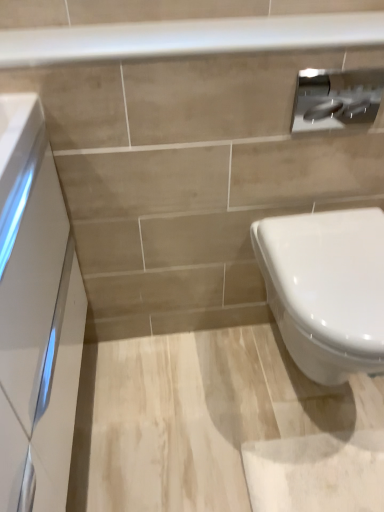
Where is `white glossy cabinet at left`? The width and height of the screenshot is (384, 512). white glossy cabinet at left is located at coordinates point(35,316).

Measure the distance between point (342, 76) and camera.

Point (342, 76) is 38.46 inches away from camera.

What do you see at coordinates (336, 98) in the screenshot? I see `satin silver toilet paper at upper right` at bounding box center [336, 98].

Identify the location of white glossy toilet at lower right. The width and height of the screenshot is (384, 512). (326, 289).

Find the location of a particular element. The height and width of the screenshot is (512, 384). white glossy balustrade at upper center is located at coordinates (189, 38).

Is the surface of white glossy toilet at lower right in direct contact with white glossy balustrade at upper center?

No, white glossy toilet at lower right is not making contact with white glossy balustrade at upper center.

From the image's perspective, is white glossy toilet at lower right below white glossy balustrade at upper center?

Yes.

Who is bigger, white glossy toilet at lower right or white glossy balustrade at upper center?

white glossy toilet at lower right is bigger.

Is white glossy toilet at lower right turned away from white glossy balustrade at upper center?

white glossy toilet at lower right does not have its back to white glossy balustrade at upper center.

How far apart are white glossy toilet at lower right and white glossy cabinet at left?

white glossy toilet at lower right is 23.64 inches away from white glossy cabinet at left.

Which object is positioned more to the left, white glossy toilet at lower right or white glossy cabinet at left?

white glossy cabinet at left is more to the left.

Is white glossy toilet at lower right outside of white glossy cabinet at left?

Yes, white glossy toilet at lower right is outside of white glossy cabinet at left.

Considering the sizes of objects white glossy toilet at lower right and white glossy cabinet at left in the image provided, who is taller, white glossy toilet at lower right or white glossy cabinet at left?

With more height is white glossy cabinet at left.

Where is `toilet paper above the white glossy cabinet at left (from a real-world perspective)`? The height and width of the screenshot is (512, 384). toilet paper above the white glossy cabinet at left (from a real-world perspective) is located at coordinates (336, 98).

From a real-world perspective, which is physically below, white glossy cabinet at left or satin silver toilet paper at upper right?

From a 3D spatial view, white glossy cabinet at left is below.

Which object is wider, white glossy cabinet at left or satin silver toilet paper at upper right?

white glossy cabinet at left is wider.

Consider the image. Which is correct: white glossy cabinet at left is inside satin silver toilet paper at upper right, or outside of it?

The correct answer is: outside.

From the image's perspective, between white glossy toilet at lower right and satin silver toilet paper at upper right, who is located below?

white glossy toilet at lower right appears lower in the image.

From a real-world perspective, is white glossy toilet at lower right positioned above or below satin silver toilet paper at upper right?

Clearly, from a real-world perspective, white glossy toilet at lower right is below satin silver toilet paper at upper right.

Considering the positions of objects white glossy toilet at lower right and satin silver toilet paper at upper right in the image provided, who is more to the right, white glossy toilet at lower right or satin silver toilet paper at upper right?

white glossy toilet at lower right.

Considering the sizes of white glossy toilet at lower right and satin silver toilet paper at upper right in the image, is white glossy toilet at lower right bigger or smaller than satin silver toilet paper at upper right?

Considering their sizes, white glossy toilet at lower right takes up more space than satin silver toilet paper at upper right.

From a real-world perspective, is white glossy balustrade at upper center below white glossy toilet at lower right?

No, from a real-world perspective, white glossy balustrade at upper center is not beneath white glossy toilet at lower right.

Is white glossy balustrade at upper center oriented towards white glossy toilet at lower right?

No, white glossy balustrade at upper center is not turned towards white glossy toilet at lower right.

Between white glossy balustrade at upper center and white glossy toilet at lower right, which one has larger width?

With larger width is white glossy toilet at lower right.

I want to click on balustrade that is behind the white glossy toilet at lower right, so (x=189, y=38).

Which is nearer, (132, 50) or (307, 116)?

Point (132, 50)

Is white glossy balustrade at upper center positioned far away from satin silver toilet paper at upper right?

No.

Between white glossy balustrade at upper center and satin silver toilet paper at upper right, which one has smaller size?

satin silver toilet paper at upper right is smaller.

From the image's perspective, which is below, white glossy balustrade at upper center or satin silver toilet paper at upper right?

satin silver toilet paper at upper right is shown below in the image.

Is satin silver toilet paper at upper right completely or partially outside of white glossy cabinet at left?

Indeed, satin silver toilet paper at upper right is completely outside white glossy cabinet at left.

From the image's perspective, which is above, satin silver toilet paper at upper right or white glossy cabinet at left?

From the image's view, satin silver toilet paper at upper right is above.

Does satin silver toilet paper at upper right have a lesser height compared to white glossy cabinet at left?

Correct, satin silver toilet paper at upper right is not as tall as white glossy cabinet at left.

Between satin silver toilet paper at upper right and white glossy cabinet at left, which one has larger size?

white glossy cabinet at left.

Identify the location of toilet below the white glossy balustrade at upper center (from the image's perspective). The width and height of the screenshot is (384, 512). (326, 289).

This screenshot has height=512, width=384. I want to click on toilet on the right of white glossy cabinet at left, so click(x=326, y=289).

When comparing their distances from white glossy cabinet at left, does white glossy balustrade at upper center or white glossy toilet at lower right seem closer?

Among the two, white glossy balustrade at upper center is located nearer to white glossy cabinet at left.

Estimate the real-world distances between objects in this image. Which object is further from satin silver toilet paper at upper right, white glossy balustrade at upper center or white glossy cabinet at left?

white glossy cabinet at left is positioned further to the anchor satin silver toilet paper at upper right.

Based on their spatial positions, is white glossy toilet at lower right or satin silver toilet paper at upper right further from white glossy balustrade at upper center?

The object further to white glossy balustrade at upper center is white glossy toilet at lower right.

Which object lies further to the anchor point white glossy cabinet at left, satin silver toilet paper at upper right or white glossy toilet at lower right?

satin silver toilet paper at upper right.

From the image, which object appears to be nearer to white glossy toilet at lower right, white glossy balustrade at upper center or satin silver toilet paper at upper right?

satin silver toilet paper at upper right lies closer to white glossy toilet at lower right than the other object.

Looking at the image, which one is located closer to white glossy toilet at lower right, satin silver toilet paper at upper right or white glossy balustrade at upper center?

The object closer to white glossy toilet at lower right is satin silver toilet paper at upper right.

Estimate the real-world distances between objects in this image. Which object is further from white glossy toilet at lower right, white glossy balustrade at upper center or white glossy cabinet at left?

The object further to white glossy toilet at lower right is white glossy cabinet at left.

When comparing their distances from white glossy balustrade at upper center, does satin silver toilet paper at upper right or white glossy toilet at lower right seem closer?

satin silver toilet paper at upper right.

Find the location of a particular element. This screenshot has height=512, width=384. toilet between white glossy balustrade at upper center and white glossy cabinet at left in the up-down direction is located at coordinates (326, 289).

You are a GUI agent. You are given a task and a screenshot of the screen. Output one action in this format:
    pyautogui.click(x=<x>, y=<y>)
    Task: Click on the toilet paper situated between white glossy cabinet at left and white glossy toilet at lower right from left to right
    The width and height of the screenshot is (384, 512).
    Given the screenshot: What is the action you would take?
    pyautogui.click(x=336, y=98)

Find the location of a particular element. This screenshot has height=512, width=384. toilet paper between white glossy balustrade at upper center and white glossy toilet at lower right vertically is located at coordinates (336, 98).

Where is `balustrade between white glossy cabinet at left and satin silver toilet paper at upper right from left to right`? balustrade between white glossy cabinet at left and satin silver toilet paper at upper right from left to right is located at coordinates (189, 38).